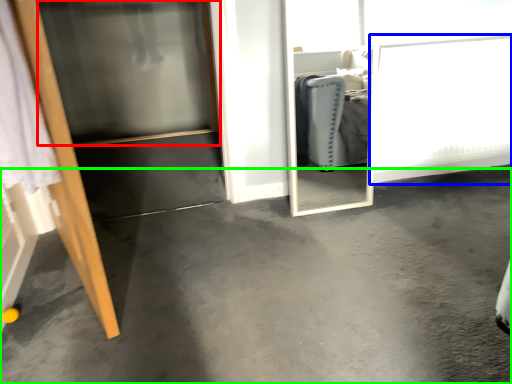
Question: Which is farther away from screen door (highlighted by a red box)? screen door (highlighted by a blue box) or concrete (highlighted by a green box)?

Choices:
 (A) screen door
 (B) concrete

Answer: (B)